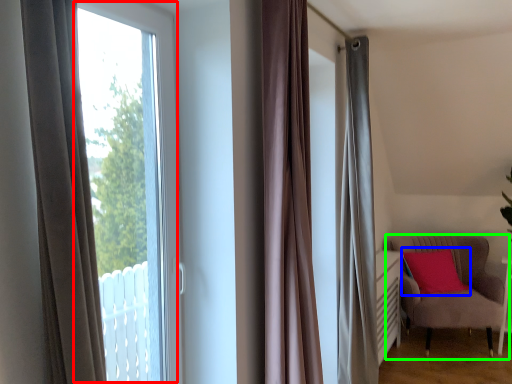
Question: Considering the real-world distances, which object is closest to bay window (highlighted by a red box)? pillow (highlighted by a blue box) or chair (highlighted by a green box).

Choices:
 (A) pillow
 (B) chair

Answer: (A)